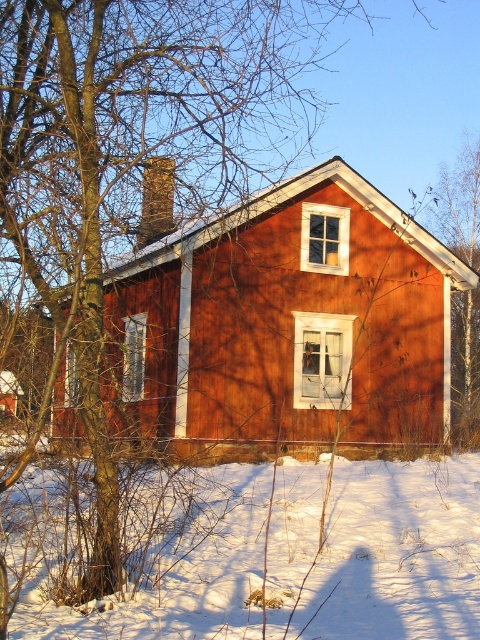
Question: Which object is farther from the camera taking this photo?

Choices:
 (A) white powdery snow at lower center
 (B) bare branches at upper right

Answer: (B)

Question: Among these points, which one is farthest from the camera?

Choices:
 (A) (282, 560)
 (B) (469, 317)

Answer: (B)

Question: Can you confirm if white powdery snow at lower center is positioned to the right of bare branches at upper right?

Choices:
 (A) no
 (B) yes

Answer: (A)

Question: Does white powdery snow at lower center have a lesser width compared to bare branches at upper right?

Choices:
 (A) yes
 (B) no

Answer: (B)

Question: Can you confirm if white powdery snow at lower center is positioned above bare branches at upper right?

Choices:
 (A) no
 (B) yes

Answer: (A)